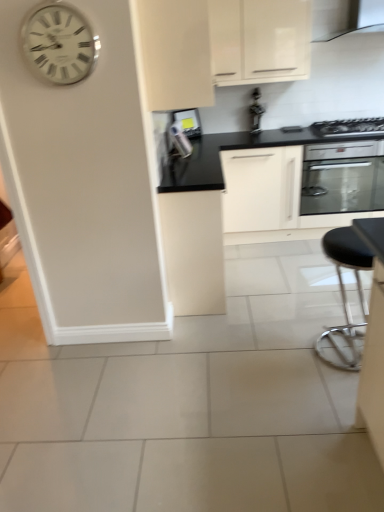
Question: Does metallic silver toaster at upper center, acting as the second appliance starting from the right, have a lesser width compared to matte white cabinet at center, the first cabinetry positioned from the bottom?

Choices:
 (A) yes
 (B) no

Answer: (A)

Question: Is metallic silver toaster at upper center, acting as the second appliance starting from the right, closer to camera compared to matte white cabinet at center, the first cabinetry positioned from the bottom?

Choices:
 (A) yes
 (B) no

Answer: (B)

Question: Considering the relative sizes of metallic silver toaster at upper center, acting as the second appliance starting from the right, and matte white cabinet at center, the first cabinetry positioned from the bottom, in the image provided, is metallic silver toaster at upper center, acting as the second appliance starting from the right, taller than matte white cabinet at center, the first cabinetry positioned from the bottom,?

Choices:
 (A) yes
 (B) no

Answer: (B)

Question: Is matte white cabinet at center, the first cabinetry positioned from the bottom, inside metallic silver toaster at upper center, acting as the second appliance starting from the right?

Choices:
 (A) yes
 (B) no

Answer: (B)

Question: From a real-world perspective, is metallic silver toaster at upper center, which is the 1th appliance in left-to-right order, on top of matte white cabinet at center, the first cabinetry positioned from the bottom?

Choices:
 (A) yes
 (B) no

Answer: (A)

Question: From a real-world perspective, is matte white cabinet at center, arranged as the 3th cabinetry when viewed from the top, above or below metallic silver toaster at upper center, which is the first appliance in right-to-left order?

Choices:
 (A) above
 (B) below

Answer: (B)

Question: Relative to metallic silver toaster at upper center, positioned as the second appliance in left-to-right order, is matte white cabinet at center, the first cabinetry positioned from the bottom, in front or behind?

Choices:
 (A) behind
 (B) front

Answer: (B)

Question: Considering the positions of point (190, 262) and point (253, 100), is point (190, 262) closer or farther from the camera than point (253, 100)?

Choices:
 (A) closer
 (B) farther

Answer: (A)

Question: Based on their sizes in the image, would you say matte white cabinet at center, the first cabinetry positioned from the bottom, is bigger or smaller than metallic silver toaster at upper center, positioned as the second appliance in left-to-right order?

Choices:
 (A) big
 (B) small

Answer: (A)

Question: Is metallic stainless steel oven at center-right wider or thinner than satin black oven at upper right?

Choices:
 (A) thin
 (B) wide

Answer: (B)

Question: Relative to satin black oven at upper right, is metallic stainless steel oven at center-right in front or behind?

Choices:
 (A) front
 (B) behind

Answer: (A)

Question: Does point (329, 175) appear closer or farther from the camera than point (372, 117)?

Choices:
 (A) farther
 (B) closer

Answer: (B)

Question: From their relative heights in the image, would you say metallic stainless steel oven at center-right is taller or shorter than satin black oven at upper right?

Choices:
 (A) tall
 (B) short

Answer: (A)

Question: Considering the positions of white matte cabinet at upper center, the 2th cabinetry when ordered from top to bottom, and white glossy cabinet at upper center, positioned as the third cabinetry in bottom-to-top order, in the image, is white matte cabinet at upper center, the 2th cabinetry when ordered from top to bottom, wider or thinner than white glossy cabinet at upper center, positioned as the third cabinetry in bottom-to-top order,?

Choices:
 (A) wide
 (B) thin

Answer: (A)

Question: Looking at the image, does white matte cabinet at upper center, the 2th cabinetry when ordered from top to bottom, seem bigger or smaller compared to white glossy cabinet at upper center, the first cabinetry positioned from the top?

Choices:
 (A) big
 (B) small

Answer: (A)